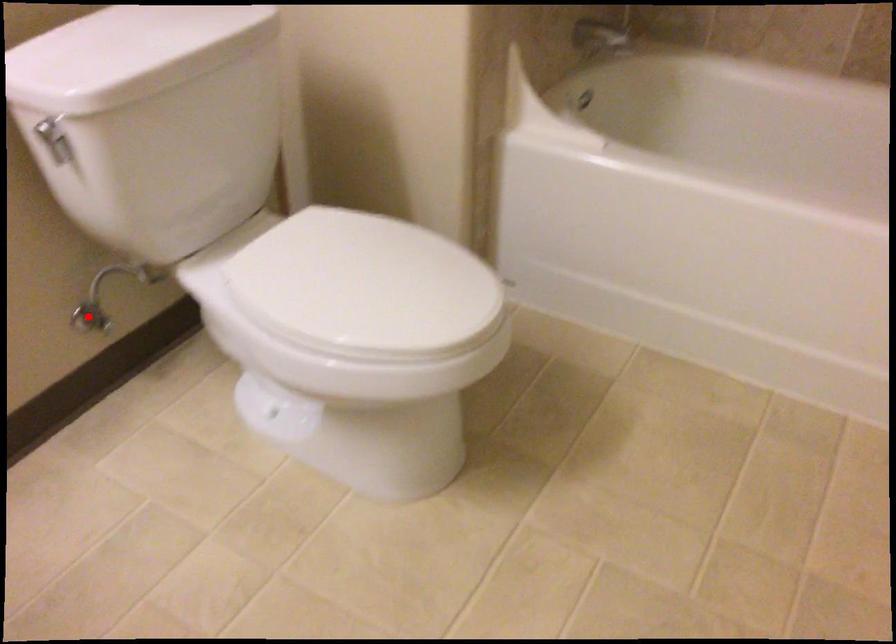
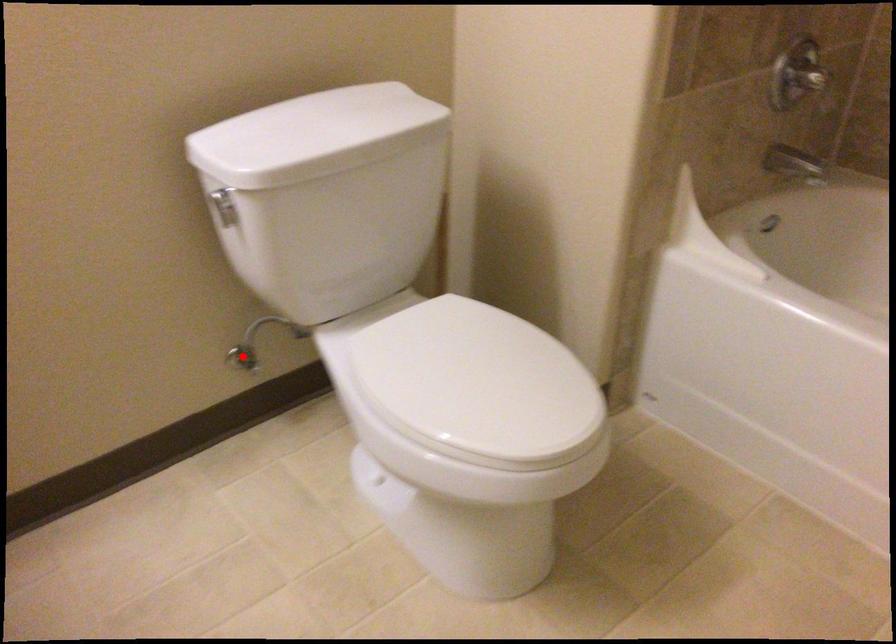
I am providing you with two images of the same scene from different viewpoints. A red point is marked on the first image and another point is marked on the second image. Are the points marked in image1 and image2 representing the same 3D position?

Yes